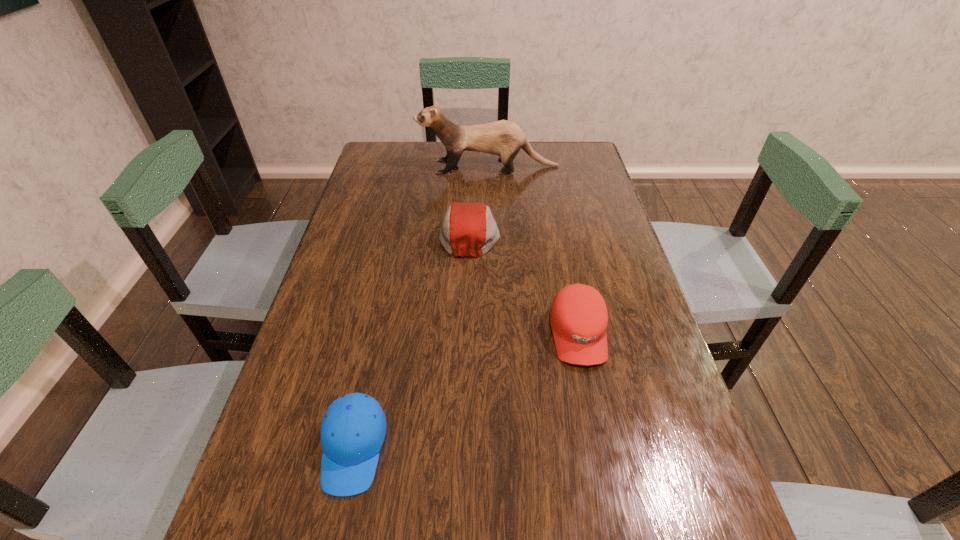
Find the location of a particular element. free point between the tallest object and the leftmost cap is located at coordinates (421, 307).

Identify the location of blank region between the tallest object and the leftmost cap. (421, 307).

Locate which object ranks second in proximity to the second nearest cap. Please provide its 2D coordinates. Your answer should be formatted as a tuple, i.e. [(x, y)], where the tuple contains the x and y coordinates of a point satisfying the conditions above.

[(353, 430)]

Identify which object is the third closest to the rightmost cap. Please provide its 2D coordinates. Your answer should be formatted as a tuple, i.e. [(x, y)], where the tuple contains the x and y coordinates of a point satisfying the conditions above.

[(504, 138)]

Identify which cap is located as the nearest to the second nearest cap. Please provide its 2D coordinates. Your answer should be formatted as a tuple, i.e. [(x, y)], where the tuple contains the x and y coordinates of a point satisfying the conditions above.

[(468, 229)]

Where is `the closest cap relative to the tallest object`? This screenshot has width=960, height=540. the closest cap relative to the tallest object is located at coordinates (468, 229).

This screenshot has width=960, height=540. I want to click on free space that satisfies the following two spatial constraints: 1. on the face of the tallest object; 2. on the front-facing side of the nearest cap, so click(496, 448).

You are a GUI agent. You are given a task and a screenshot of the screen. Output one action in this format:
    pyautogui.click(x=<x>, y=<y>)
    Task: Click on the vacant space that satisfies the following two spatial constraints: 1. on the front-facing side of the farthest cap; 2. on the front-facing side of the nearest cap
    Image resolution: width=960 pixels, height=540 pixels.
    Given the screenshot: What is the action you would take?
    pyautogui.click(x=465, y=448)